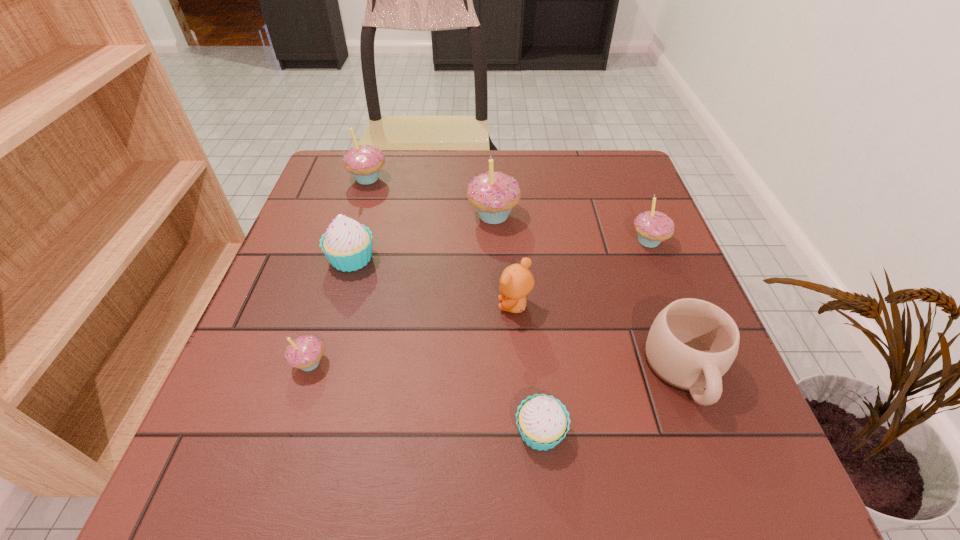
I want to click on vacant space positioned on the face of the teddy bear, so click(468, 306).

This screenshot has height=540, width=960. In order to click on vacant space located 0.370m on the face of the teddy bear in this screenshot , I will do `click(311, 306)`.

Identify the location of vacant area situated 0.050m on the side of the mug with the handle. (712, 447).

Find the location of a particular element. The image size is (960, 540). vacant region located 0.170m on the back of the second nearest cupcake is located at coordinates (336, 280).

Locate an element on the screen. Image resolution: width=960 pixels, height=540 pixels. vacant region located on the back of the nearer white cupcake is located at coordinates (532, 347).

Locate an element on the screen. The height and width of the screenshot is (540, 960). object positioned at the near edge is located at coordinates [542, 421].

In order to click on cupcake that is at the right edge in this screenshot , I will do `click(653, 227)`.

Image resolution: width=960 pixels, height=540 pixels. I want to click on mug positioned at the right edge, so click(692, 343).

Locate an element on the screen. object that is at the far left corner is located at coordinates (364, 162).

I want to click on vacant space at the far edge of the desktop, so click(506, 157).